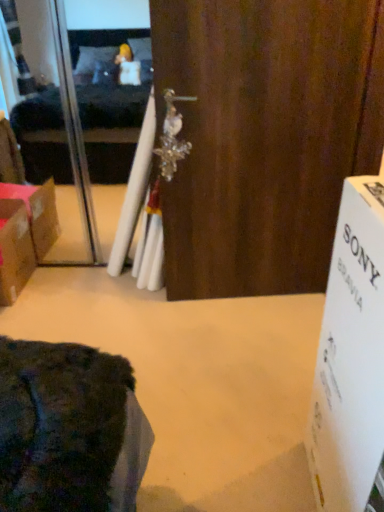
Identify the location of free space in front of wooden door at center. Image resolution: width=384 pixels, height=512 pixels. (240, 348).